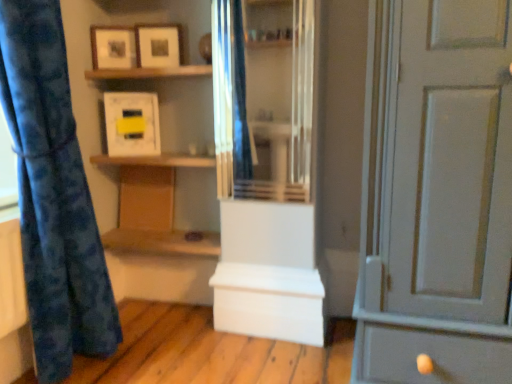
Question: Does point (198, 160) appear closer or farther from the camera than point (159, 135)?

Choices:
 (A) farther
 (B) closer

Answer: (B)

Question: Considering the positions of wooden shelf at center, arranged as the 1th shelf when ordered from the bottom, and matte white picture frame at upper center, which is the first picture frame in bottom-to-top order, in the image, is wooden shelf at center, arranged as the 1th shelf when ordered from the bottom, wider or thinner than matte white picture frame at upper center, which is the first picture frame in bottom-to-top order,?

Choices:
 (A) thin
 (B) wide

Answer: (B)

Question: Which object is positioned closest to the clear glass cabinet at center?

Choices:
 (A) blue fabric curtain at left
 (B) wooden shelf at center, the 2th shelf in the top-to-bottom sequence
 (C) matte white picture frame at upper left, which is the 2th picture frame in top-to-bottom order
 (D) matte white picture frame at upper center, placed as the third picture frame when sorted from bottom to top
 (E) wooden shelf at upper center, the 2th shelf from the bottom

Answer: (D)

Question: Estimate the real-world distances between objects in this image. Which object is closer to the white painted wood door at right?

Choices:
 (A) matte white picture frame at upper left, which is the 2th picture frame in top-to-bottom order
 (B) wooden shelf at center, the 2th shelf in the top-to-bottom sequence
 (C) matte white picture frame at upper center, arranged as the 3th picture frame when viewed from the top
 (D) matte brown cabinet at center, which is the second cabinetry in right-to-left order
 (E) blue fabric curtain at left

Answer: (B)